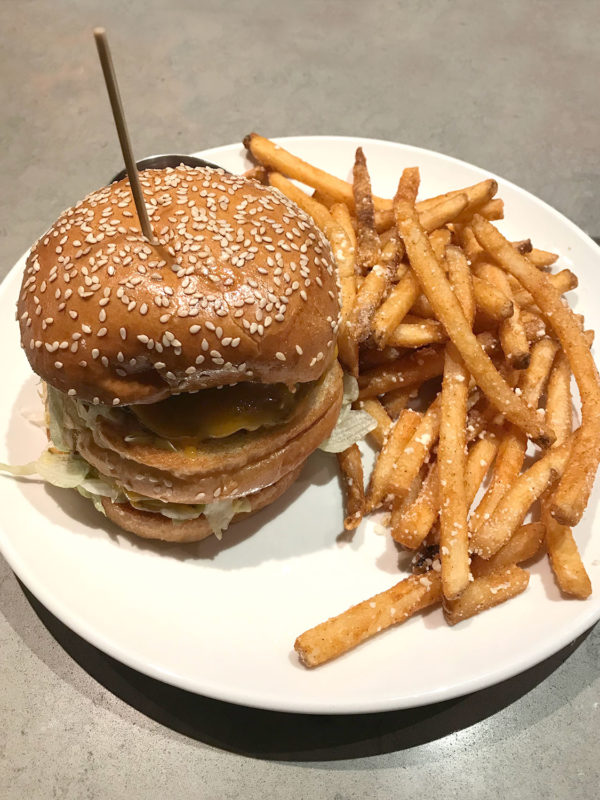
The image size is (600, 800). Identify the location of granite countertop. (19, 754), (419, 64).